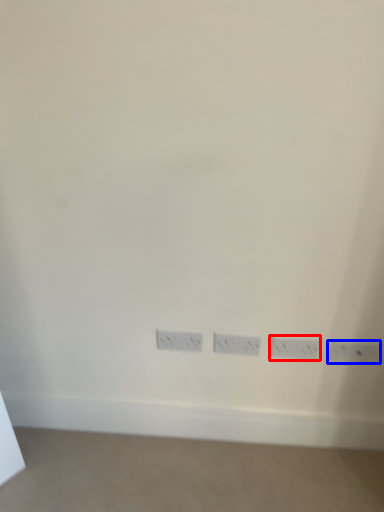
Question: Which point is further to the camera, power plugs and sockets (highlighted by a red box) or power plugs and sockets (highlighted by a blue box)?

Choices:
 (A) power plugs and sockets
 (B) power plugs and sockets

Answer: (A)